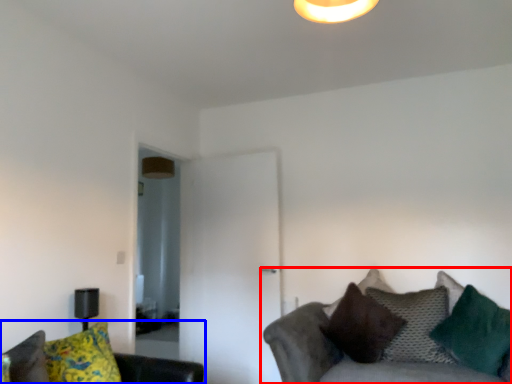
Question: Which object appears farthest to the camera in this image, studio couch (highlighted by a red box) or studio couch (highlighted by a blue box)?

Choices:
 (A) studio couch
 (B) studio couch

Answer: (A)